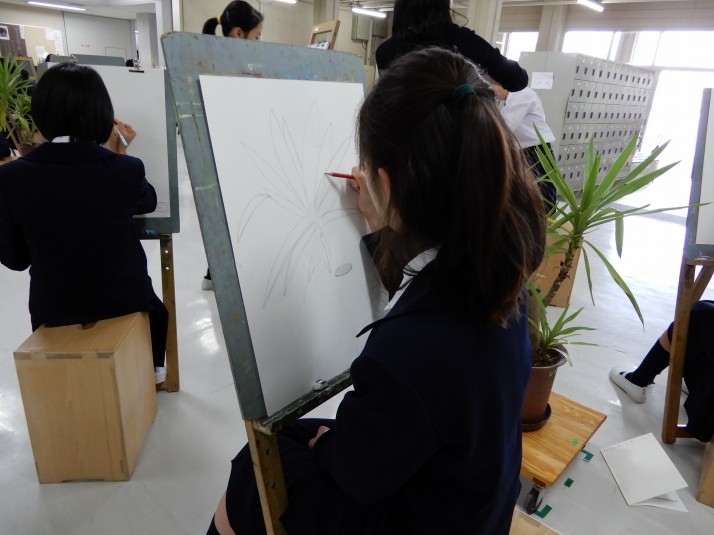
Where is `lights`? This screenshot has width=714, height=535. lights is located at coordinates (587, 11), (368, 13), (64, 7), (291, 2).